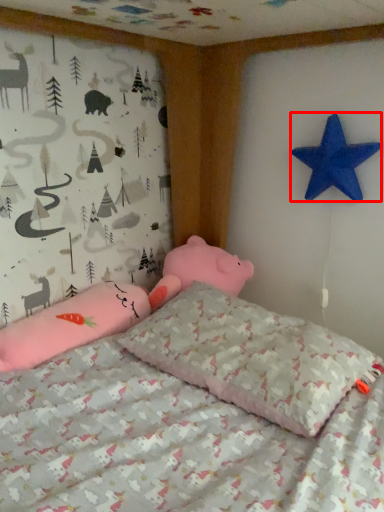
Question: Where is starfish (annotated by the red box) located in relation to pillow in the image?

Choices:
 (A) right
 (B) left

Answer: (A)